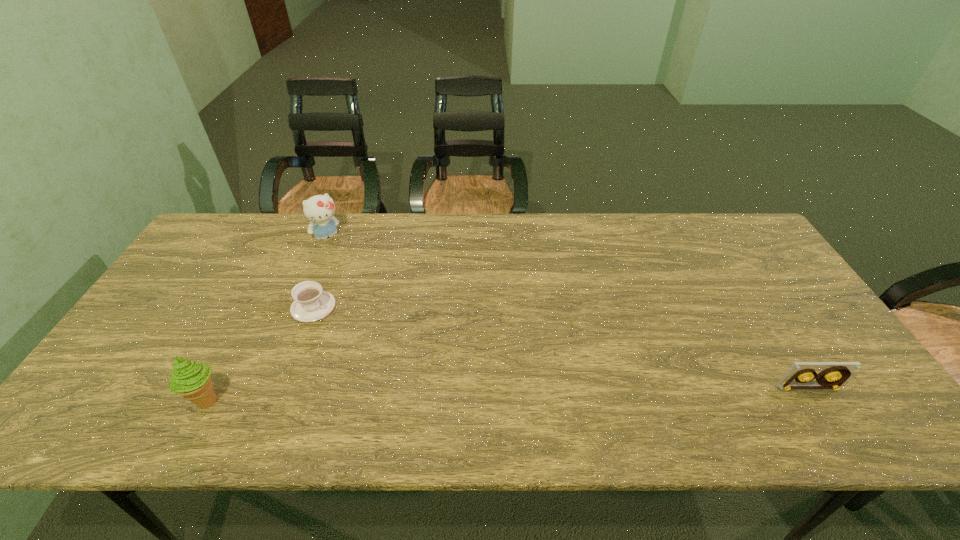
At what (x,y) coordinates should I click in order to perform the action: click on free spot between the icecream and the rightmost object. Please return your answer as a coordinate pair (x, y). This screenshot has width=960, height=540. Looking at the image, I should click on (508, 394).

This screenshot has width=960, height=540. In order to click on vacant region between the icecream and the kitten in this screenshot , I will do click(268, 319).

Identify the location of the closest object to the shortest object. This screenshot has height=540, width=960. (319, 209).

At what (x,y) coordinates should I click in order to perform the action: click on the third closest object to the videotape. Please return your answer as a coordinate pair (x, y). Looking at the image, I should click on (192, 380).